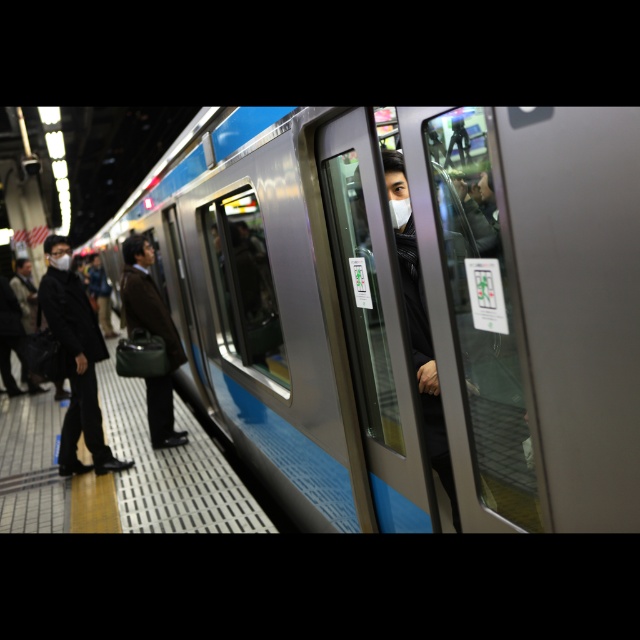
Based on the coordinates provided in the scene description, where is the metallic silver train at center located?

The metallic silver train at center is located at point [410,304].

You are a passenger waiting on the subway platform. You see a person in a black matte suit at left and another in a matte brown coat at center. Which person is closer to the edge of the platform?

The black matte suit at left is closer to the edge of the platform because it is positioned under the matte brown coat at center, indicating it is lower in the image and thus nearer to the tactile paving strip along the edge.